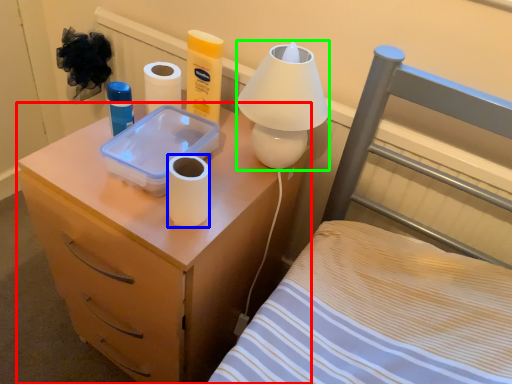
Question: Based on their relative distances, which object is nearer to nightstand (highlighted by a red box)? Choose from toilet paper (highlighted by a blue box) and table lamp (highlighted by a green box).

Choices:
 (A) toilet paper
 (B) table lamp

Answer: (A)